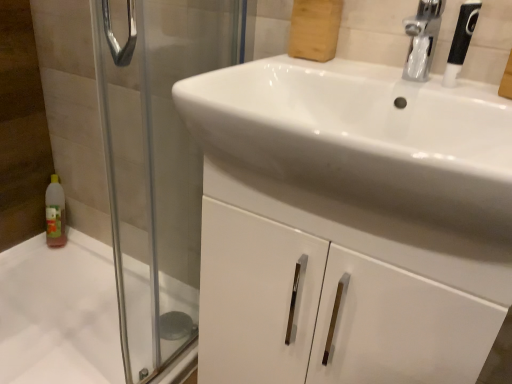
The height and width of the screenshot is (384, 512). Identify the location of vacant space that is to the left of transparent glass screen door at left. (65, 328).